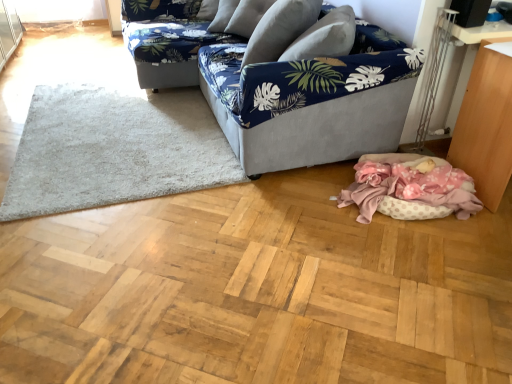
In the scene shown: In order to face blue floral fabric couch at upper center, arranged as the second studio couch when viewed from the front, should I rotate leftwards or rightwards?

It's best to rotate left around 6.160 degrees.

Measure the distance between point (389, 167) and camera.

A distance of 7.94 feet exists between point (389, 167) and camera.

What is the approximate width of wooden table at lower right?

It is 20.63 inches.

Locate an element on the screen. blue floral fabric couch at upper center, the 1th studio couch viewed from the back is located at coordinates (167, 40).

Is white shaggy rug at lower left at the right side of blue floral fabric couch at upper center, the 1th studio couch viewed from the back?

No, white shaggy rug at lower left is not to the right of blue floral fabric couch at upper center, the 1th studio couch viewed from the back.

What's the angular difference between white shaggy rug at lower left and blue floral fabric couch at upper center, arranged as the second studio couch when viewed from the front,'s facing directions?

white shaggy rug at lower left and blue floral fabric couch at upper center, arranged as the second studio couch when viewed from the front, are facing 87.3 degrees away from each other.

Is white shaggy rug at lower left turned away from blue floral fabric couch at upper center, the 1th studio couch viewed from the back?

No.

Is white shaggy rug at lower left further to the viewer compared to blue floral fabric couch at upper center, arranged as the second studio couch when viewed from the front?

No, the depth of white shaggy rug at lower left is less than that of blue floral fabric couch at upper center, arranged as the second studio couch when viewed from the front.

From the image's perspective, relative to navy blue fabric couch at center, which is the 2th studio couch in back-to-front order, is blue fabric pillow at center above or below?

blue fabric pillow at center is situated higher than navy blue fabric couch at center, which is the 2th studio couch in back-to-front order, in the image.

Which of these two, blue fabric pillow at center or navy blue fabric couch at center, which is the 2th studio couch in back-to-front order, is thinner?

blue fabric pillow at center.

Considering the positions of point (250, 45) and point (304, 63), is point (250, 45) closer or farther from the camera than point (304, 63)?

Clearly, point (250, 45) is more distant from the camera than point (304, 63).

Locate an element on the screen. pillow behind the navy blue fabric couch at center, which is the 2th studio couch in back-to-front order is located at coordinates (280, 29).

Who is smaller, white shaggy rug at lower left or wooden table at lower right?

With smaller size is white shaggy rug at lower left.

Looking at this image, who is taller, white shaggy rug at lower left or wooden table at lower right?

With more height is wooden table at lower right.

Could you tell me if white shaggy rug at lower left is facing wooden table at lower right?

No.

Is point (88, 186) positioned behind point (492, 194)?

Yes, point (88, 186) is farther from viewer.

In terms of height, does blue fabric pillow at center look taller or shorter compared to pink polka dot blanket at lower right?

Considering their sizes, blue fabric pillow at center has more height than pink polka dot blanket at lower right.

Consider the image. Could you tell me if blue fabric pillow at center is facing pink polka dot blanket at lower right?

No, blue fabric pillow at center is not facing towards pink polka dot blanket at lower right.

From a real-world perspective, which object stands above the other?

blue fabric pillow at center is physically above.

What's the angular difference between blue fabric pillow at center and pink polka dot blanket at lower right's facing directions?

The angular difference between blue fabric pillow at center and pink polka dot blanket at lower right is 119 degrees.

Measure the distance between white shaggy rug at lower left and pink polka dot blanket at lower right.

white shaggy rug at lower left and pink polka dot blanket at lower right are 1.23 meters apart.

Which is more to the left, white shaggy rug at lower left or pink polka dot blanket at lower right?

white shaggy rug at lower left is more to the left.

Is point (216, 126) closer or farther from the camera than point (409, 200)?

Point (216, 126).

Who is taller, white shaggy rug at lower left or pink polka dot blanket at lower right?

With more height is pink polka dot blanket at lower right.

Is blue floral fabric couch at upper center, arranged as the second studio couch when viewed from the front, taller than navy blue fabric couch at center, which is the 2th studio couch in back-to-front order?

No, blue floral fabric couch at upper center, arranged as the second studio couch when viewed from the front, is not taller than navy blue fabric couch at center, which is the 2th studio couch in back-to-front order.

Considering the points (144, 23) and (362, 136), which point is in front, point (144, 23) or point (362, 136)?

Positioned in front is point (362, 136).

Is there a large distance between pink polka dot blanket at lower right and blue fabric pillow at center?

Actually, pink polka dot blanket at lower right and blue fabric pillow at center are a little close together.

From their relative heights in the image, would you say pink polka dot blanket at lower right is taller or shorter than blue fabric pillow at center?

pink polka dot blanket at lower right is shorter than blue fabric pillow at center.

Consider the image. From the image's perspective, is pink polka dot blanket at lower right located above or below blue fabric pillow at center?

Based on their image positions, pink polka dot blanket at lower right is located beneath blue fabric pillow at center.

Identify the location of studio couch that is the 2nd one when counting upward from the white shaggy rug at lower left (from the image's perspective). The height and width of the screenshot is (384, 512). coord(167,40).

I want to click on pillow on the left of the navy blue fabric couch at center, marked as the 1th studio couch in a front-to-back arrangement, so click(x=280, y=29).

Based on their spatial positions, is pink polka dot blanket at lower right or wooden table at lower right closer to white shaggy rug at lower left?

pink polka dot blanket at lower right is positioned closer to the anchor white shaggy rug at lower left.

When comparing their distances from pink polka dot blanket at lower right, does blue fabric pillow at center or navy blue fabric couch at center, which is the 2th studio couch in back-to-front order, seem further?

Based on the image, blue fabric pillow at center appears to be further to pink polka dot blanket at lower right.

Looking at the image, which one is located closer to blue floral fabric couch at upper center, the 1th studio couch viewed from the back, pink polka dot blanket at lower right or navy blue fabric couch at center, marked as the 1th studio couch in a front-to-back arrangement?

navy blue fabric couch at center, marked as the 1th studio couch in a front-to-back arrangement.

Looking at the image, which one is located further to blue fabric pillow at center, white shaggy rug at lower left or blue floral fabric couch at upper center, arranged as the second studio couch when viewed from the front?

blue floral fabric couch at upper center, arranged as the second studio couch when viewed from the front.

Considering their positions, is navy blue fabric couch at center, which is the 2th studio couch in back-to-front order, positioned further to white shaggy rug at lower left than wooden table at lower right?

wooden table at lower right is positioned further to the anchor white shaggy rug at lower left.

Based on the photo, considering their positions, is wooden table at lower right positioned closer to blue fabric pillow at center than white shaggy rug at lower left?

Based on the image, white shaggy rug at lower left appears to be nearer to blue fabric pillow at center.

Considering their positions, is blue fabric pillow at center positioned closer to navy blue fabric couch at center, marked as the 1th studio couch in a front-to-back arrangement, than white shaggy rug at lower left?

Among the two, blue fabric pillow at center is located nearer to navy blue fabric couch at center, marked as the 1th studio couch in a front-to-back arrangement.

Which object lies further to the anchor point blue fabric pillow at center, blue floral fabric couch at upper center, the 1th studio couch viewed from the back, or wooden table at lower right?

The object further to blue fabric pillow at center is wooden table at lower right.

In order to click on studio couch between white shaggy rug at lower left and navy blue fabric couch at center, marked as the 1th studio couch in a front-to-back arrangement in this screenshot , I will do `click(167, 40)`.

Locate an element on the screen. This screenshot has height=384, width=512. studio couch between blue fabric pillow at center and pink polka dot blanket at lower right in the vertical direction is located at coordinates (311, 97).

Where is `studio couch that lies between blue floral fabric couch at upper center, arranged as the second studio couch when viewed from the front, and pink polka dot blanket at lower right from top to bottom`? The height and width of the screenshot is (384, 512). studio couch that lies between blue floral fabric couch at upper center, arranged as the second studio couch when viewed from the front, and pink polka dot blanket at lower right from top to bottom is located at coordinates (311, 97).

Where is `pillow between navy blue fabric couch at center, marked as the 1th studio couch in a front-to-back arrangement, and blue floral fabric couch at upper center, arranged as the second studio couch when viewed from the front, in the front-back direction`? The height and width of the screenshot is (384, 512). pillow between navy blue fabric couch at center, marked as the 1th studio couch in a front-to-back arrangement, and blue floral fabric couch at upper center, arranged as the second studio couch when viewed from the front, in the front-back direction is located at coordinates (280, 29).